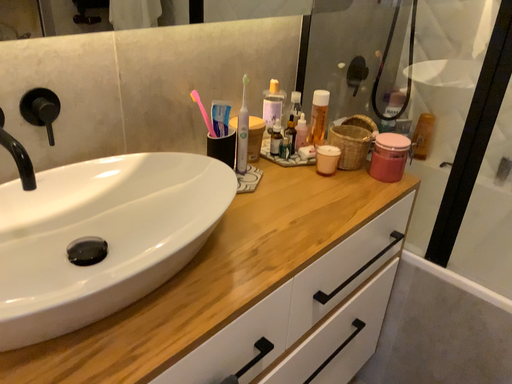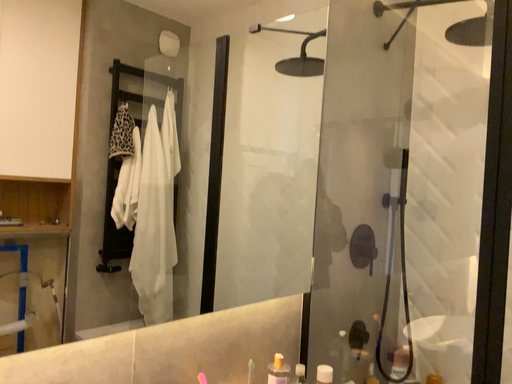
Question: How did the camera likely rotate when shooting the video?

Choices:
 (A) rotated upward
 (B) rotated downward

Answer: (A)